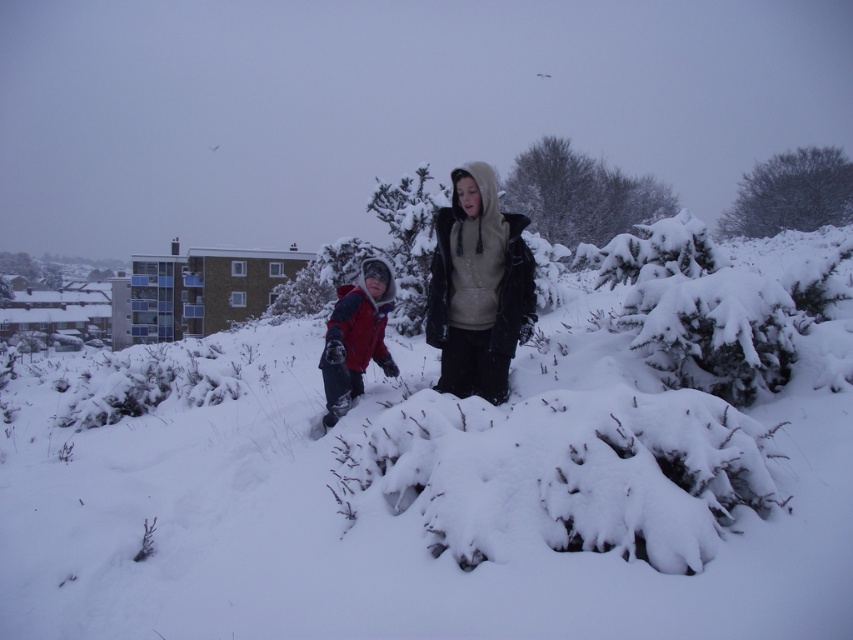
Which is behind, point (544, 209) or point (780, 198)?

Point (780, 198)

In order to click on snow-covered bush at upper center in this screenshot , I will do `click(579, 195)`.

Who is shorter, dark gray fleece jacket at center or snow-covered tree at upper right?

Standing shorter between the two is dark gray fleece jacket at center.

Is point (515, 339) less distant than point (790, 163)?

Yes, point (515, 339) is in front of point (790, 163).

At what (x,y) coordinates should I click in order to perform the action: click on dark gray fleece jacket at center. Please return your answer as a coordinate pair (x, y). The height and width of the screenshot is (640, 853). Looking at the image, I should click on (479, 288).

Does dark gray fleece jacket at center appear under snow-covered bush at upper center?

Yes.

Who is higher up, dark gray fleece jacket at center or snow-covered bush at upper center?

Positioned higher is snow-covered bush at upper center.

Measure the distance between dark gray fleece jacket at center and camera.

A distance of 4.96 meters exists between dark gray fleece jacket at center and camera.

Where is `dark gray fleece jacket at center`? This screenshot has height=640, width=853. dark gray fleece jacket at center is located at coordinates (479, 288).